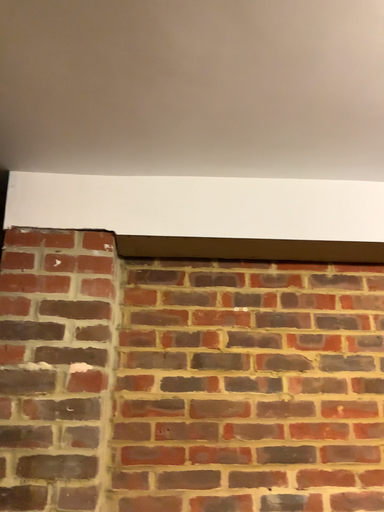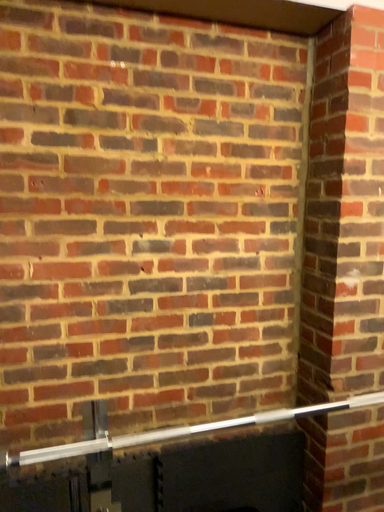
Question: Which way did the camera rotate in the video?

Choices:
 (A) rotated downward
 (B) rotated upward

Answer: (A)